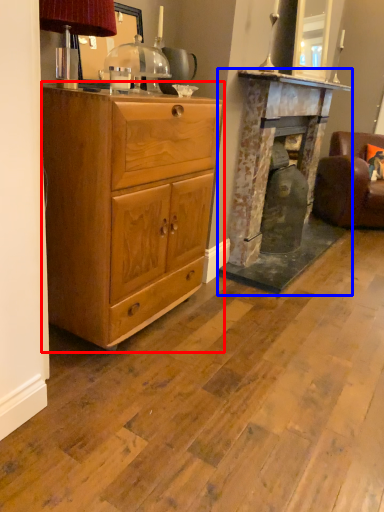
Question: Which object appears farthest to the camera in this image, chest of drawers (highlighted by a red box) or fireplace (highlighted by a blue box)?

Choices:
 (A) chest of drawers
 (B) fireplace

Answer: (B)